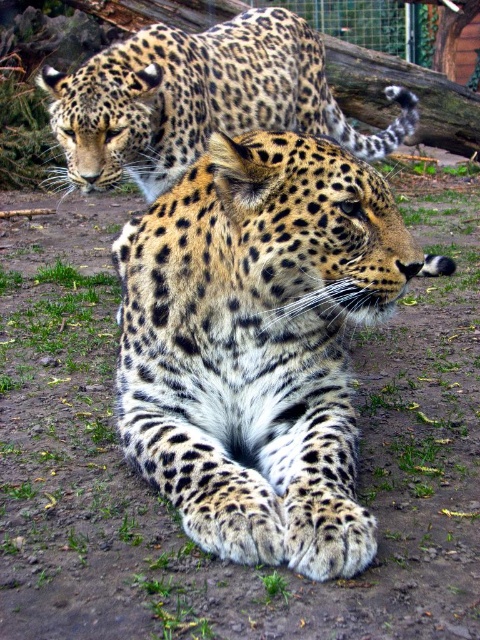
You are a zookeeper trying to identify the animals in the enclosure. You see a spotted fur cheetah at center and a spotted fur leopard at upper center. Which of these two animals is wider?

The spotted fur leopard at upper center is wider than the spotted fur cheetah at center, as the cheetah at center has a smaller width according to the description.

You are standing in front of the leopard enclosure at the zoo. You notice a specific point in the scene at coordinates point [230,260]. If you want to take a photo that includes both the foreground leopard and this point, will you need to adjust your camera angle to include the point in the frame?

The point [230,260] is 8.51 feet away from the camera. Since the foreground leopard is closer to the camera than this point, adjusting the camera angle would be necessary to include both in the frame.